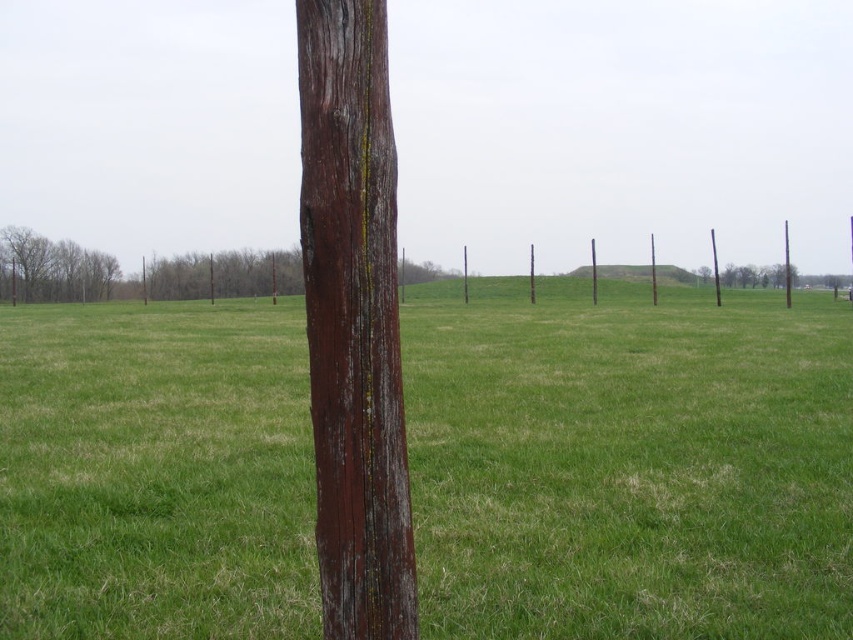
How far apart are smooth brown pole at right and brown wooden pole at center?

The distance of smooth brown pole at right from brown wooden pole at center is 12.55 meters.

Locate an element on the screen. The width and height of the screenshot is (853, 640). smooth brown pole at right is located at coordinates (786, 266).

What do you see at coordinates (786, 266) in the screenshot? I see `smooth brown pole at right` at bounding box center [786, 266].

Where is `smooth brown pole at right`? The width and height of the screenshot is (853, 640). smooth brown pole at right is located at coordinates (786, 266).

Does weathered wood pole at center appear on the left side of smooth brown pole at right?

Indeed, weathered wood pole at center is positioned on the left side of smooth brown pole at right.

Who is shorter, weathered wood pole at center or smooth brown pole at right?

Standing shorter between the two is weathered wood pole at center.

Identify the location of weathered wood pole at center. (352, 321).

Where is `weathered wood pole at center`? weathered wood pole at center is located at coordinates (352, 321).

Consider the image. Is weathered wood pole at center positioned before brown wooden pole at center?

That is True.

Is point (320, 60) positioned behind point (651, 289)?

No, (320, 60) is in front of (651, 289).

Where is `weathered wood pole at center`? Image resolution: width=853 pixels, height=640 pixels. weathered wood pole at center is located at coordinates pos(352,321).